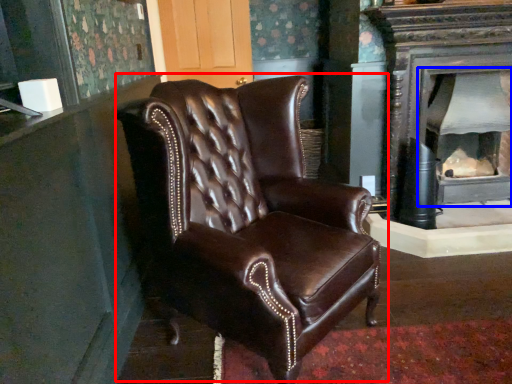
Question: Which point is closer to the camera, chair (highlighted by a red box) or fireplace (highlighted by a blue box)?

Choices:
 (A) chair
 (B) fireplace

Answer: (A)